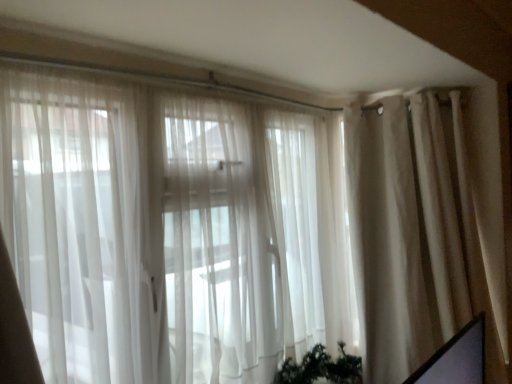
Question: From a real-world perspective, is matte black screen at lower right positioned above or below beige fabric curtain at right?

Choices:
 (A) below
 (B) above

Answer: (A)

Question: Which is correct: matte black screen at lower right is inside beige fabric curtain at right, or outside of it?

Choices:
 (A) outside
 (B) inside

Answer: (A)

Question: From the image's perspective, is matte black screen at lower right located above or below beige fabric curtain at right?

Choices:
 (A) below
 (B) above

Answer: (A)

Question: Does point (388, 114) appear closer or farther from the camera than point (446, 359)?

Choices:
 (A) closer
 (B) farther

Answer: (B)

Question: From a real-world perspective, is beige fabric curtain at right physically located above or below matte black screen at lower right?

Choices:
 (A) below
 (B) above

Answer: (B)

Question: Is beige fabric curtain at right taller or shorter than matte black screen at lower right?

Choices:
 (A) tall
 (B) short

Answer: (A)

Question: Is beige fabric curtain at right inside or outside of matte black screen at lower right?

Choices:
 (A) outside
 (B) inside

Answer: (A)